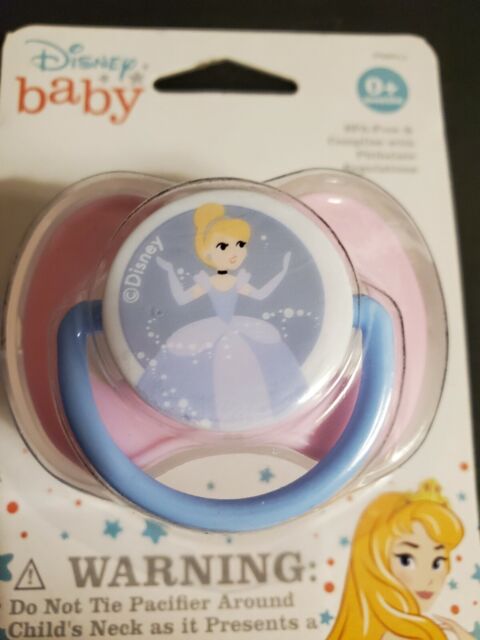
Identify the location of pacifier. (291, 221), (126, 436).